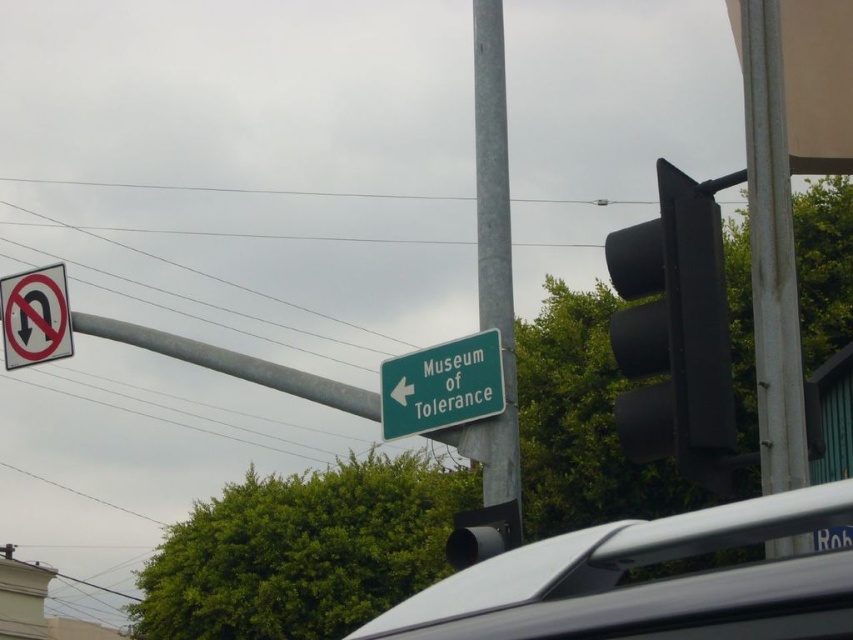
Question: Is black matte traffic light at right positioned before white plastic sign at upper left?

Choices:
 (A) no
 (B) yes

Answer: (B)

Question: Does black matte traffic light at right have a larger size compared to green matte sign at center?

Choices:
 (A) no
 (B) yes

Answer: (B)

Question: Which of the following is the closest to the observer?

Choices:
 (A) green matte sign at center
 (B) silver metallic car at center
 (C) metallic gray pole at upper right
 (D) black matte traffic light at right

Answer: (C)

Question: Which point is closer to the camera taking this photo?

Choices:
 (A) (482, 360)
 (B) (53, 346)
 (C) (793, 282)
 (D) (546, 566)

Answer: (D)

Question: Is metallic pole at center positioned before white plastic sign at upper left?

Choices:
 (A) yes
 (B) no

Answer: (A)

Question: Which is farther from the silver metallic car at center?

Choices:
 (A) black matte traffic light at right
 (B) metallic pole at center

Answer: (B)